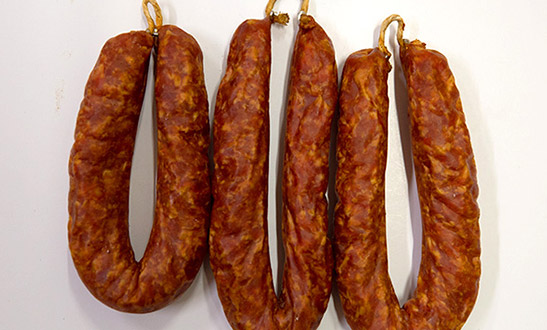
Where is `hooks`? Image resolution: width=547 pixels, height=330 pixels. hooks is located at coordinates (405, 42), (386, 56), (302, 14), (272, 18), (154, 30).